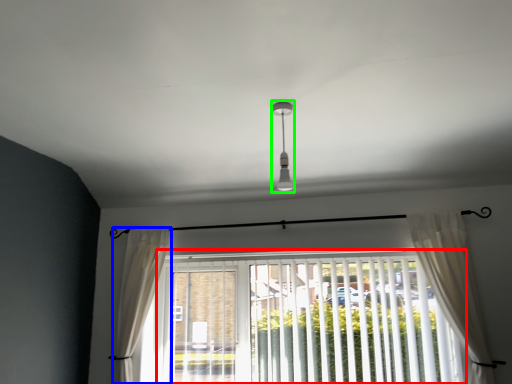
Question: Considering the real-world distances, which object is farthest from window blind (highlighted by a red box)? curtain (highlighted by a blue box) or light fixture (highlighted by a green box)?

Choices:
 (A) curtain
 (B) light fixture

Answer: (B)